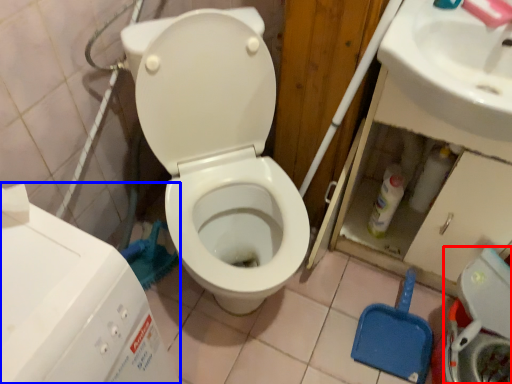
Question: Which object appears farthest to the camera in this image, washer (highlighted by a red box) or water tank (highlighted by a blue box)?

Choices:
 (A) washer
 (B) water tank

Answer: (A)